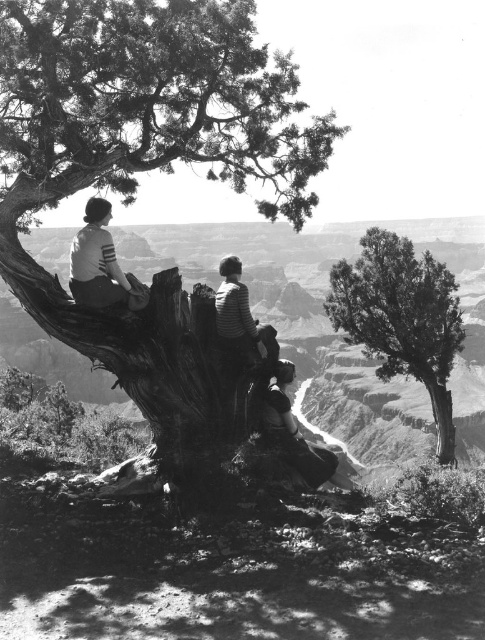
Can you confirm if rough bark tree trunk at left is shorter than striped jersey at upper left?

Incorrect, rough bark tree trunk at left's height does not fall short of striped jersey at upper left's.

Does rough bark tree trunk at left appear under striped jersey at upper left?

Indeed, rough bark tree trunk at left is positioned under striped jersey at upper left.

Is point (170, 17) farther from viewer compared to point (112, 257)?

Yes, point (170, 17) is behind point (112, 257).

At what (x,y) coordinates should I click in order to perform the action: click on rough bark tree trunk at left. Please return your answer as a coordinate pair (x, y). This screenshot has width=485, height=640. Looking at the image, I should click on (144, 168).

From the picture: Does rough bark tree trunk at left have a lesser width compared to smooth bark tree at right?

Correct, rough bark tree trunk at left's width is less than smooth bark tree at right's.

Does rough bark tree trunk at left appear on the right side of smooth bark tree at right?

Incorrect, rough bark tree trunk at left is not on the right side of smooth bark tree at right.

Between point (263, 49) and point (381, 342), which one is positioned in front?

Positioned in front is point (263, 49).

The image size is (485, 640). I want to click on rough bark tree trunk at left, so click(144, 168).

Which is more to the right, smooth bark tree at right or striped jersey at upper left?

smooth bark tree at right is more to the right.

Does point (410, 273) come behind point (96, 269)?

Yes.

Is point (388, 301) closer to camera compared to point (85, 208)?

No.

This screenshot has width=485, height=640. Identify the location of smooth bark tree at right. (402, 317).